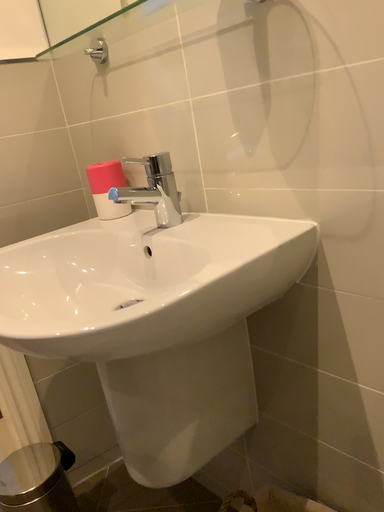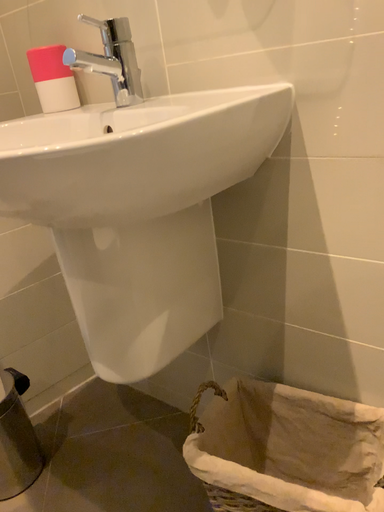
Question: Which way did the camera rotate in the video?

Choices:
 (A) rotated right
 (B) rotated left

Answer: (A)